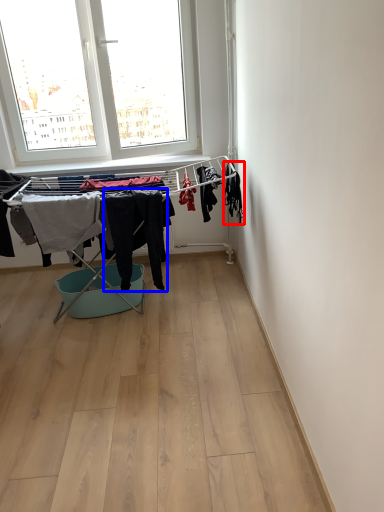
Question: Among these objects, which one is farthest to the camera, clothing (highlighted by a red box) or clothing (highlighted by a blue box)?

Choices:
 (A) clothing
 (B) clothing

Answer: (A)